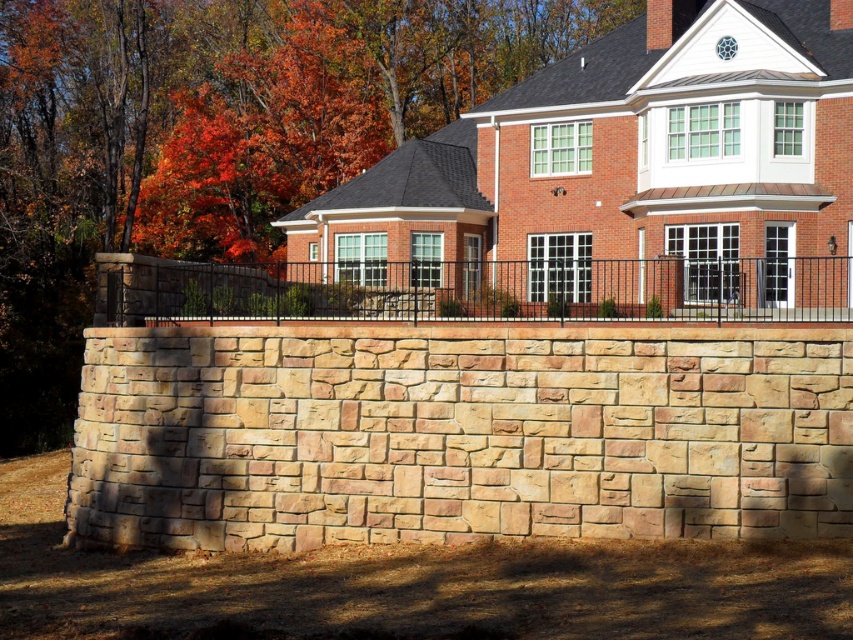
Looking at this image, you are standing in the yard of the house and want to see the orange leafy tree at upper center. Can you see it from behind the black metal fence at center?

The orange leafy tree at upper center is positioned over the black metal fence at center, so yes, you can see it from behind the black metal fence at center.

You are standing in the front yard of the house and want to take a photo of both the orange leafy tree at upper center and the black metal fence at center. Which object will appear wider in the photo?

The orange leafy tree at upper center will appear wider in the photo because its width surpasses that of the black metal fence at center.